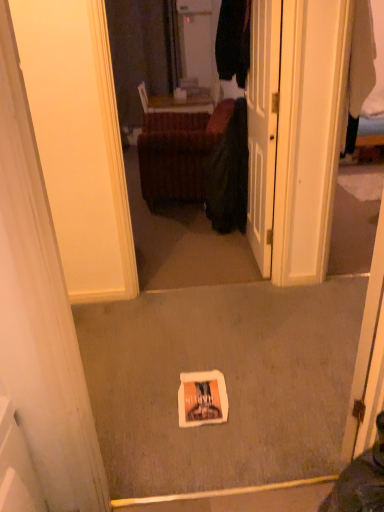
Question: In terms of size, does white glossy door at center appear bigger or smaller than velvet brown ottoman at center?

Choices:
 (A) small
 (B) big

Answer: (A)

Question: Does point (273, 180) appear closer or farther from the camera than point (162, 176)?

Choices:
 (A) farther
 (B) closer

Answer: (B)

Question: Considering the real-world distances, which object is closest to the white glossy door at center?

Choices:
 (A) dark green fabric at center
 (B) velvet brown ottoman at center

Answer: (A)

Question: Estimate the real-world distances between objects in this image. Which object is closer to the dark green fabric at center?

Choices:
 (A) white glossy door at center
 (B) velvet brown ottoman at center

Answer: (B)